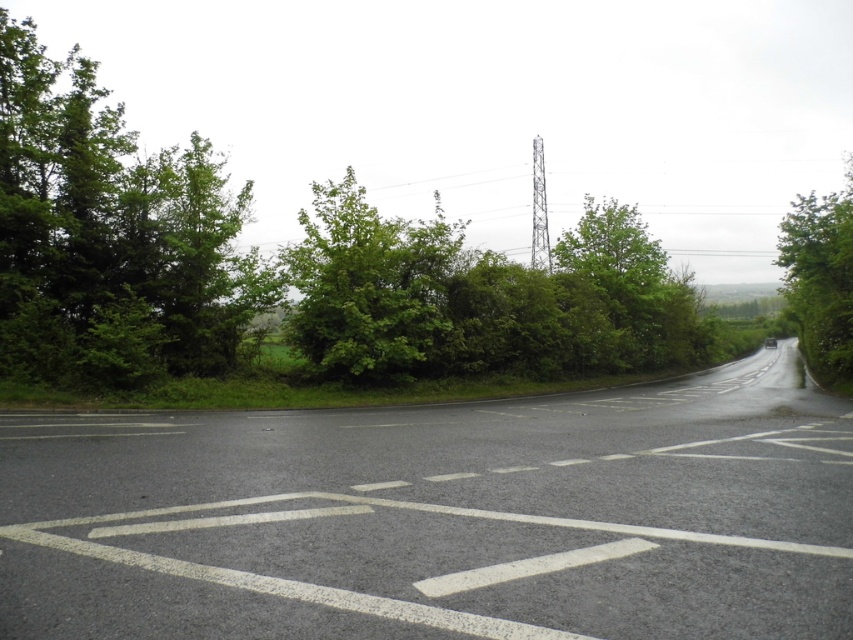
You are a drone operator trying to navigate between two points in the image. The points are labeled as point (259, 273) and point (44, 70). Which point is closer to the electrical pylon in the background?

Point (44, 70) is closer to the electrical pylon in the background because it is closer to the viewer compared to point (259, 273), which is further away.

You are a pedestrian standing on the rural road and want to walk to the green leafy tree at right. Which direction should you walk to avoid the green leafy bush at center?

The green leafy bush at center is positioned on the left side of green leafy tree at right, so you should walk to the right side of the green leafy tree at right to avoid it.

You are a landscape architect planning to install a new bench along the rural road. The bench requires a minimum of 50 meters of space between the green leafy tree at left and the green leafy tree at right for proper placement. Based on the scene description, will the existing spacing between these two trees meet the requirement?

The distance between the green leafy tree at left and the green leafy tree at right is 49.75 meters, which is slightly less than the required 50 meters. Therefore, the existing spacing does not meet the requirement for the bench placement.